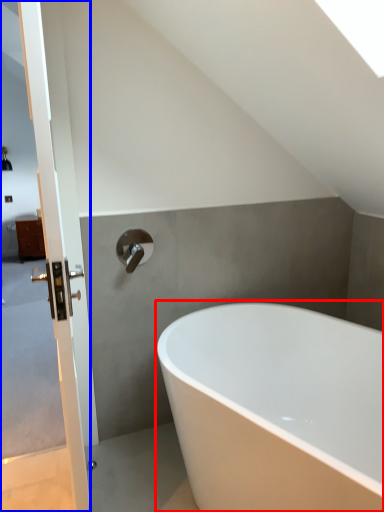
Question: Which object is closer to the camera taking this photo, bathtub (highlighted by a red box) or screen door (highlighted by a blue box)?

Choices:
 (A) bathtub
 (B) screen door

Answer: (B)